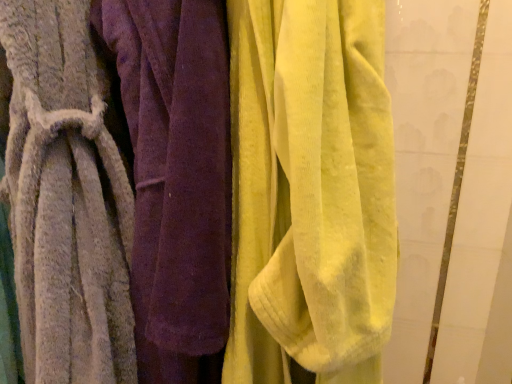
Question: Considering the relative sizes of velvet yellow towel at center, positioned as the 1th towel in right-to-left order, and gray textured towel at left, which ranks as the 1th towel in left-to-right order, in the image provided, is velvet yellow towel at center, positioned as the 1th towel in right-to-left order, shorter than gray textured towel at left, which ranks as the 1th towel in left-to-right order,?

Choices:
 (A) no
 (B) yes

Answer: (B)

Question: Does velvet yellow towel at center, the 3th towel when ordered from left to right, come behind gray textured towel at left, which ranks as the 1th towel in left-to-right order?

Choices:
 (A) no
 (B) yes

Answer: (A)

Question: Does velvet yellow towel at center, positioned as the 1th towel in right-to-left order, have a lesser width compared to gray textured towel at left, the third towel when ordered from right to left?

Choices:
 (A) yes
 (B) no

Answer: (A)

Question: Would you consider velvet yellow towel at center, the 3th towel when ordered from left to right, to be distant from gray textured towel at left, the third towel when ordered from right to left?

Choices:
 (A) no
 (B) yes

Answer: (A)

Question: Is velvet yellow towel at center, the 3th towel when ordered from left to right, located outside gray textured towel at left, which ranks as the 1th towel in left-to-right order?

Choices:
 (A) no
 (B) yes

Answer: (B)

Question: Considering the positions of soft gray towel at left, placed as the 2th towel when sorted from right to left, and velvet yellow towel at center, positioned as the 1th towel in right-to-left order, in the image, is soft gray towel at left, placed as the 2th towel when sorted from right to left, wider or thinner than velvet yellow towel at center, positioned as the 1th towel in right-to-left order,?

Choices:
 (A) thin
 (B) wide

Answer: (A)

Question: From the image's perspective, is soft gray towel at left, placed as the 2th towel when sorted from right to left, located above or below velvet yellow towel at center, the 3th towel when ordered from left to right?

Choices:
 (A) below
 (B) above

Answer: (B)

Question: Would you say soft gray towel at left, which is the second towel in left-to-right order, is inside or outside velvet yellow towel at center, positioned as the 1th towel in right-to-left order?

Choices:
 (A) outside
 (B) inside

Answer: (A)

Question: From a real-world perspective, is soft gray towel at left, which is the second towel in left-to-right order, above or below velvet yellow towel at center, positioned as the 1th towel in right-to-left order?

Choices:
 (A) above
 (B) below

Answer: (B)

Question: From a real-world perspective, is velvet yellow towel at center, positioned as the 1th towel in right-to-left order, positioned above or below soft gray towel at left, which is the second towel in left-to-right order?

Choices:
 (A) below
 (B) above

Answer: (B)

Question: Based on their positions, is velvet yellow towel at center, positioned as the 1th towel in right-to-left order, located to the left or right of soft gray towel at left, placed as the 2th towel when sorted from right to left?

Choices:
 (A) left
 (B) right

Answer: (B)

Question: Is point click(x=296, y=4) positioned closer to the camera than point click(x=159, y=198)?

Choices:
 (A) farther
 (B) closer

Answer: (B)

Question: From the image's perspective, is velvet yellow towel at center, positioned as the 1th towel in right-to-left order, above or below soft gray towel at left, placed as the 2th towel when sorted from right to left?

Choices:
 (A) below
 (B) above

Answer: (A)

Question: Relative to gray textured towel at left, which ranks as the 1th towel in left-to-right order, is soft gray towel at left, placed as the 2th towel when sorted from right to left, in front or behind?

Choices:
 (A) behind
 (B) front

Answer: (A)

Question: Would you say soft gray towel at left, placed as the 2th towel when sorted from right to left, is to the left or to the right of gray textured towel at left, which ranks as the 1th towel in left-to-right order, in the picture?

Choices:
 (A) right
 (B) left

Answer: (A)